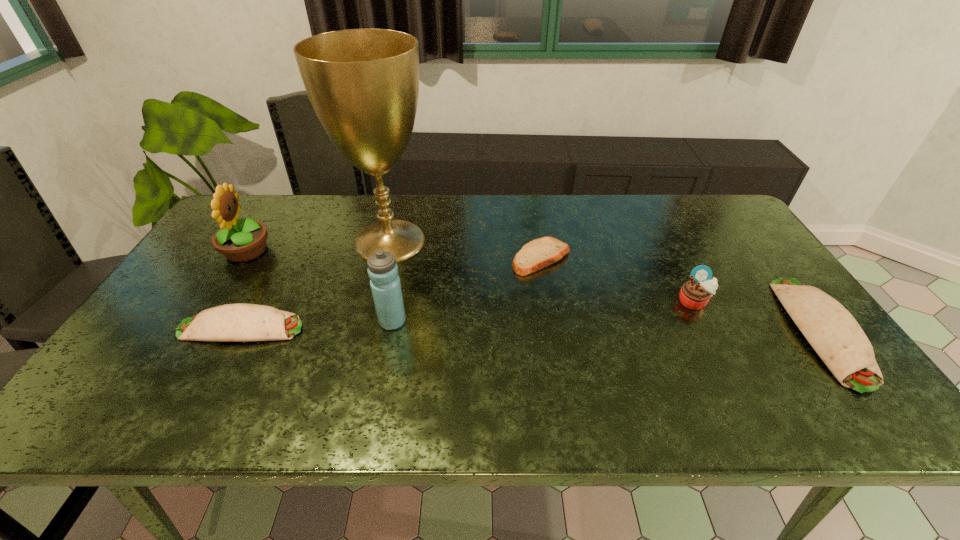
At what (x,y) coordinates should I click in order to perform the action: click on location for an additional burrito to make spacing equal. Please return your answer as a coordinate pair (x, y). Looking at the image, I should click on (x=530, y=329).